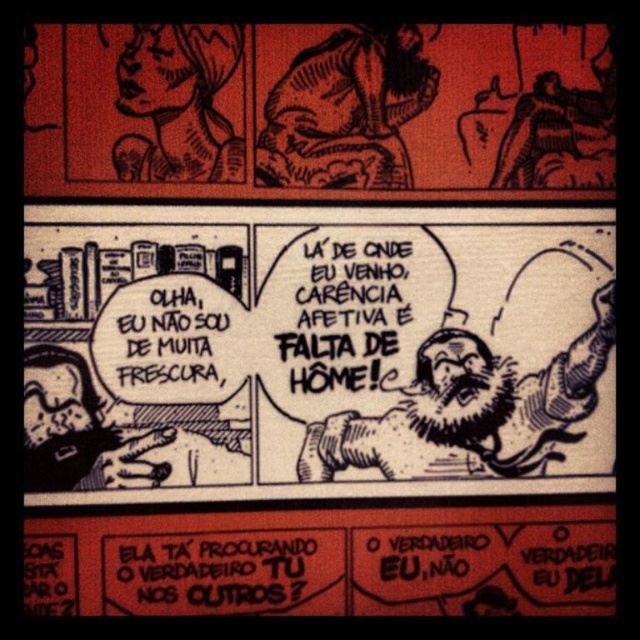
Question: In this image, where is black ink speech bubble at center located relative to black ink speech bubble at upper center?

Choices:
 (A) above
 (B) below

Answer: (B)

Question: Which point is closer to the camera taking this photo?

Choices:
 (A) (42, 573)
 (B) (490, 52)

Answer: (A)

Question: From the image, what is the correct spatial relationship of black ink speech bubble at upper center in relation to black paper speech bubble at lower center?

Choices:
 (A) below
 (B) above

Answer: (B)

Question: Among these objects, which one is farthest from the camera?

Choices:
 (A) black ink speech bubble at upper center
 (B) black ink speech bubble at center

Answer: (B)

Question: Which point appears closest to the camera in this image?

Choices:
 (A) (356, 163)
 (B) (61, 384)
 (C) (429, 600)

Answer: (B)

Question: Can you confirm if black ink speech bubble at center is thinner than black paper speech bubble at lower center?

Choices:
 (A) no
 (B) yes

Answer: (A)